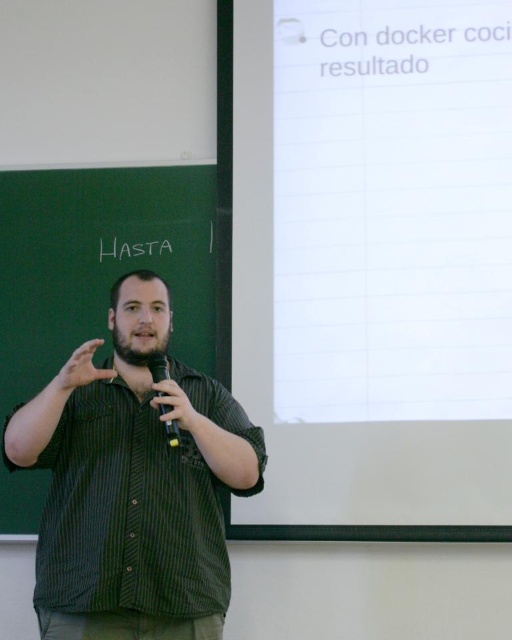
Who is positioned more to the left, matte black microphone at center or black plastic microphone at center?

Positioned to the left is matte black microphone at center.

Does matte black microphone at center have a smaller size compared to black plastic microphone at center?

Yes.

Is point (183, 410) farther from camera compared to point (152, 355)?

No.

Where is `matte black microphone at center`? Image resolution: width=512 pixels, height=640 pixels. matte black microphone at center is located at coordinates (174, 404).

Can you confirm if green striped shirt at center is positioned above black plastic microphone at center?

Incorrect, green striped shirt at center is not positioned above black plastic microphone at center.

Measure the distance between green striped shirt at center and black plastic microphone at center.

green striped shirt at center is 9.39 inches from black plastic microphone at center.

The width and height of the screenshot is (512, 640). I want to click on green striped shirt at center, so (134, 490).

I want to click on green striped shirt at center, so click(134, 490).

Is the position of matte black hand at center more distant than that of black plastic microphone at center?

No.

Describe the element at coordinates (80, 369) in the screenshot. The image size is (512, 640). I see `matte black hand at center` at that location.

The image size is (512, 640). In order to click on matte black hand at center in this screenshot , I will do `click(80, 369)`.